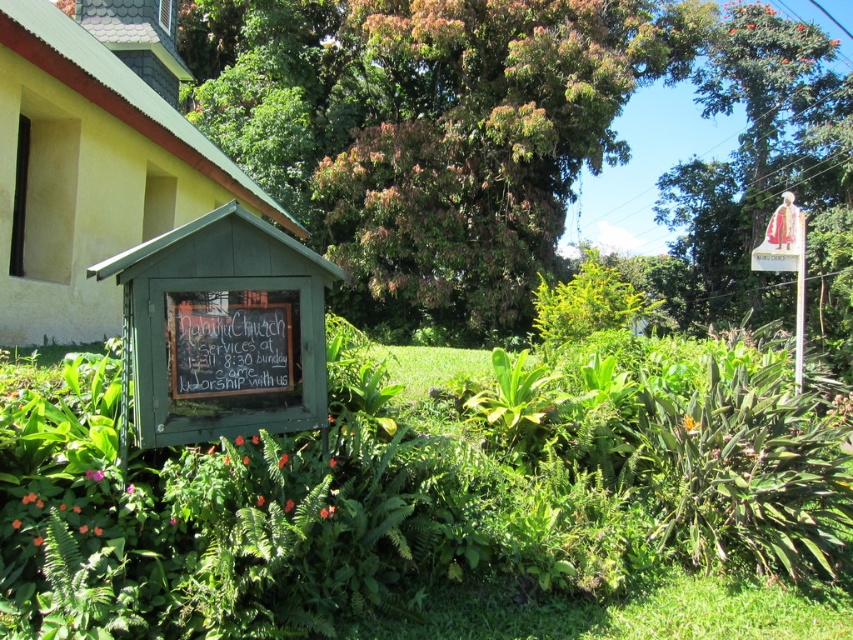
Question: Does black chalkboard at center appear over wooden sign at upper right?

Choices:
 (A) yes
 (B) no

Answer: (B)

Question: Which point appears farthest from the camera in this image?

Choices:
 (A) (198, 372)
 (B) (247, 460)
 (C) (268, 388)
 (D) (788, 246)

Answer: (D)

Question: Which point is closer to the camera?

Choices:
 (A) green matte signboard at lower left
 (B) green matte signboard at center
 (C) green leafy tree at upper center

Answer: (A)

Question: Estimate the real-world distances between objects in this image. Which object is closer to the green matte signboard at lower left?

Choices:
 (A) green wood signboard at lower left
 (B) green leafy tree at upper center
 (C) black chalkboard at center

Answer: (C)

Question: Does green leafy tree at center appear on the left side of black chalkboard at center?

Choices:
 (A) no
 (B) yes

Answer: (A)

Question: Does green leafy tree at center appear under black chalkboard at center?

Choices:
 (A) no
 (B) yes

Answer: (A)